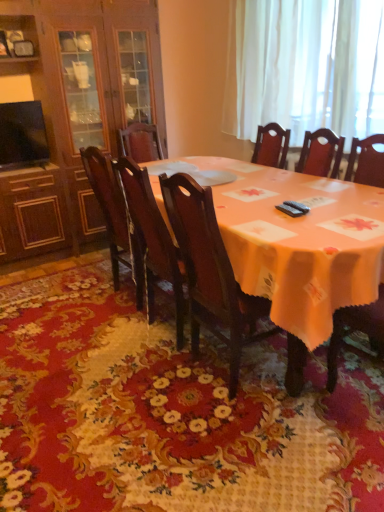
Identify the location of vacant space situated on the left part of dark wood chair at center, which is counted as the 2th chair, starting from the right. This screenshot has height=512, width=384. (102, 341).